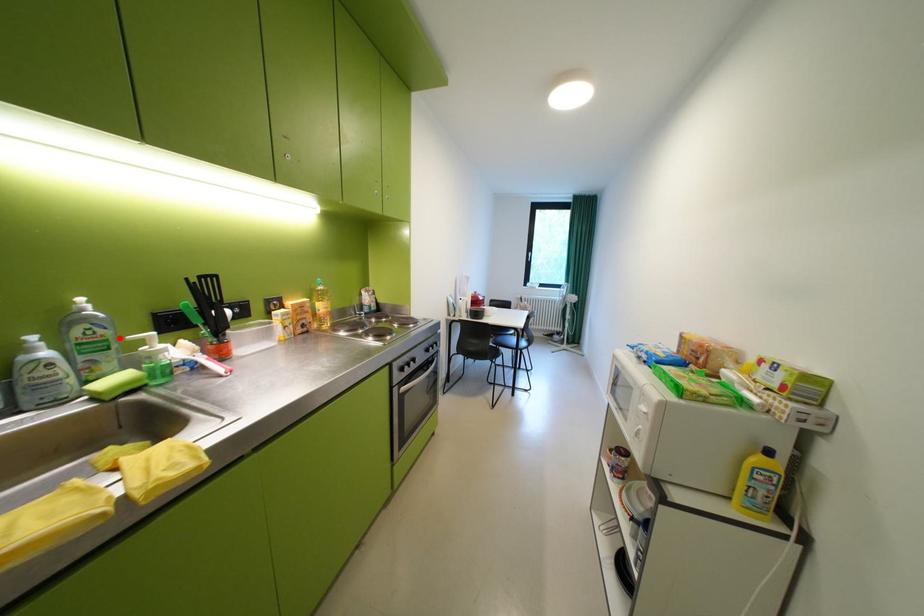
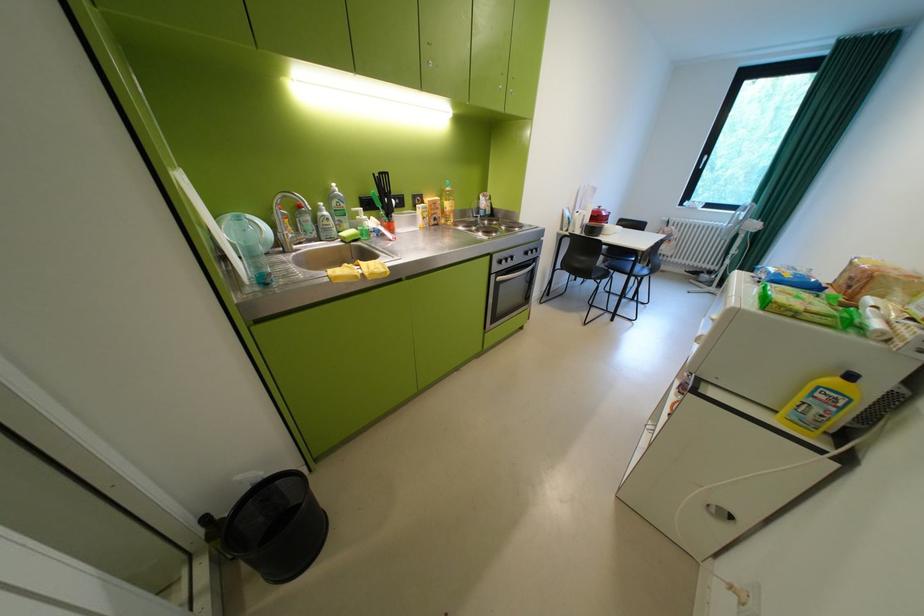
Locate, in the second image, the point that corresponds to the highlighted location in the first image.

(356, 209)